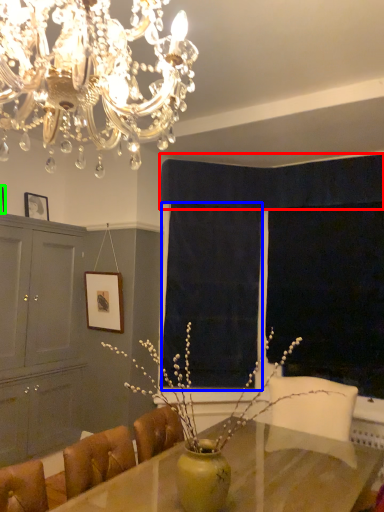
Question: Which is farther away from curtain (highlighted by a red box)? curtain (highlighted by a blue box) or picture frame (highlighted by a green box)?

Choices:
 (A) curtain
 (B) picture frame

Answer: (B)